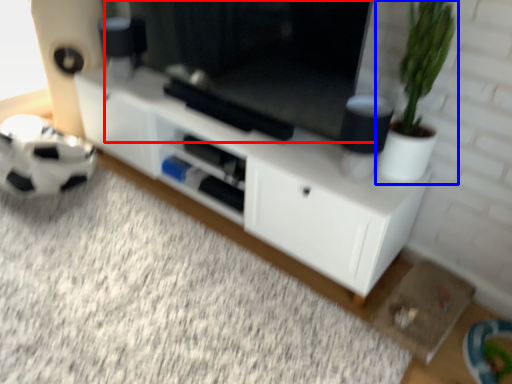
Question: Which point is closer to the camera, window screen (highlighted by a red box) or houseplant (highlighted by a blue box)?

Choices:
 (A) window screen
 (B) houseplant

Answer: (B)